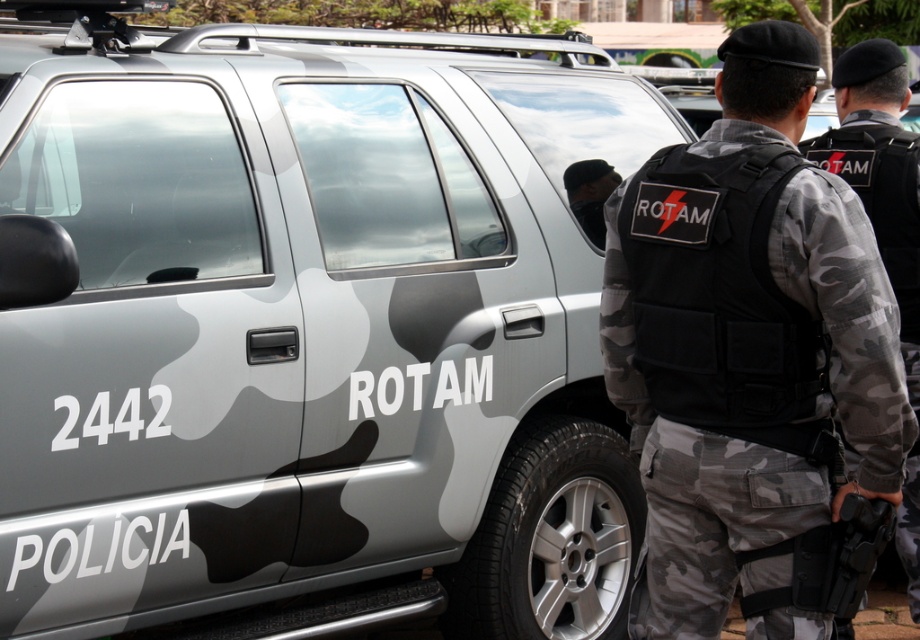
You are a safety inspector checking the equipment of two officers. You notice both officers are wearing a black tactical vest at center and a camouflage fabric vest at center. Which vest has a larger width according to the description?

The black tactical vest at center might be wider than camouflage fabric vest at center according to the description.